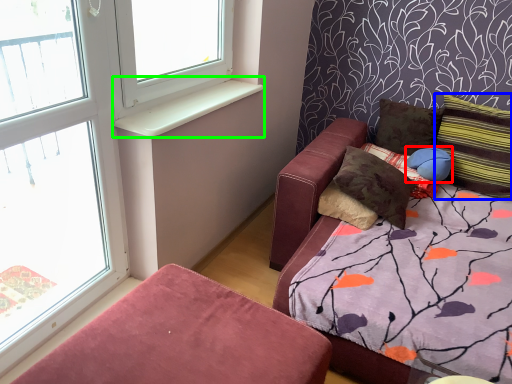
Question: Estimate the real-world distances between objects in this image. Which object is closer to pillow (highlighted by a red box), pillow (highlighted by a blue box) or window sill (highlighted by a green box)?

Choices:
 (A) pillow
 (B) window sill

Answer: (A)